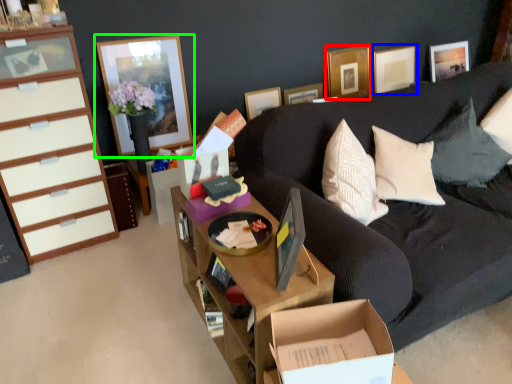
Question: Which object is the farthest from picture frame (highlighted by a red box)? Choose among these: picture frame (highlighted by a blue box) or picture frame (highlighted by a green box).

Choices:
 (A) picture frame
 (B) picture frame

Answer: (B)